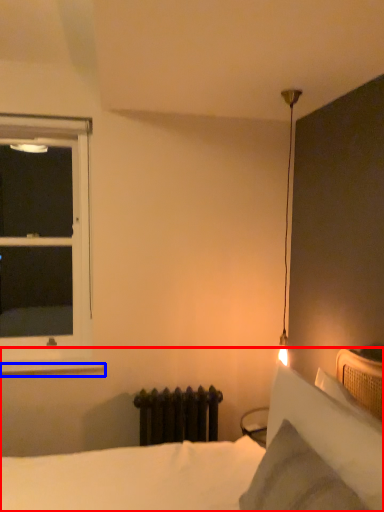
Question: Which object is closer to the camera taking this photo, bed (highlighted by a red box) or window sill (highlighted by a blue box)?

Choices:
 (A) bed
 (B) window sill

Answer: (A)